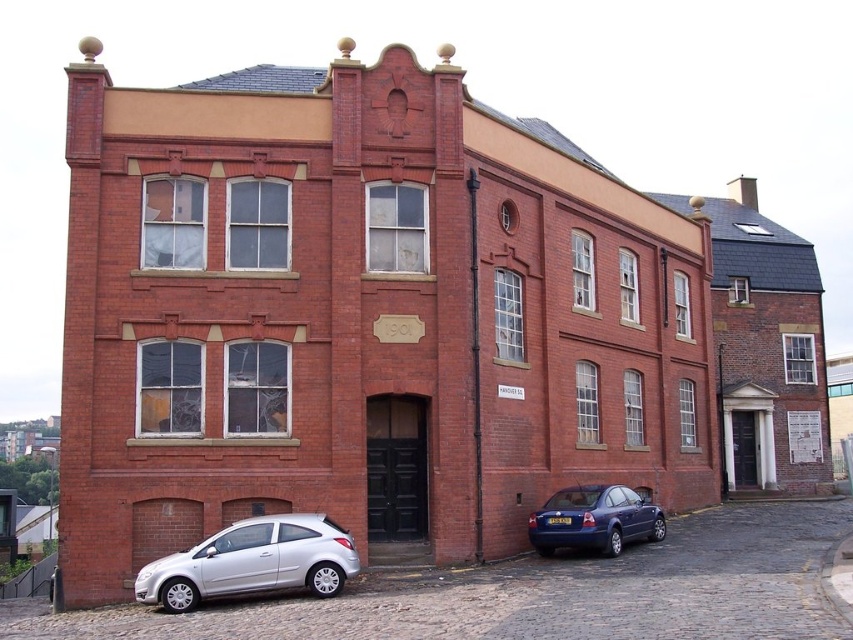
Who is taller, silver metallic hatchback at lower left or metallic blue sedan at lower right?

With more height is silver metallic hatchback at lower left.

The width and height of the screenshot is (853, 640). Identify the location of silver metallic hatchback at lower left. tap(253, 561).

Locate an element on the screen. silver metallic hatchback at lower left is located at coordinates (253, 561).

The height and width of the screenshot is (640, 853). In order to click on silver metallic hatchback at lower left in this screenshot , I will do `click(253, 561)`.